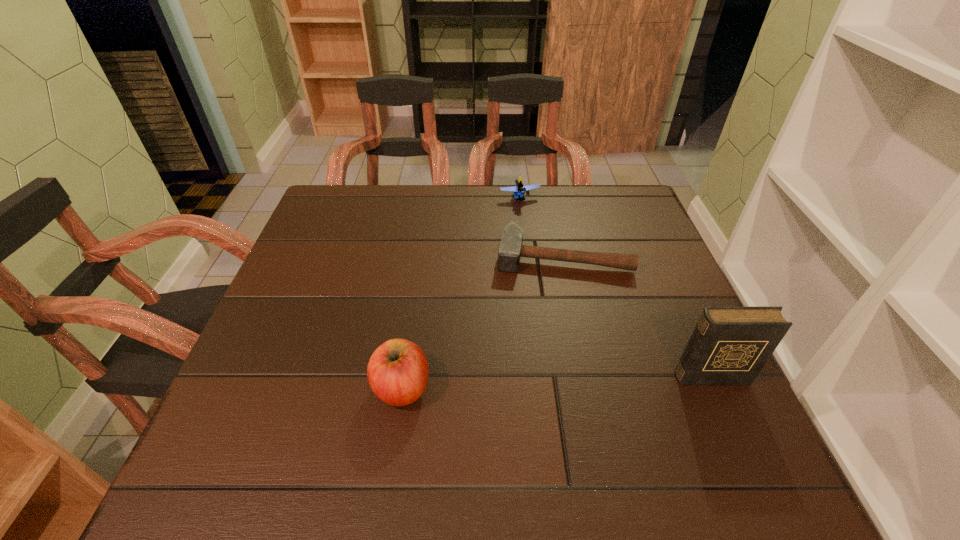
This screenshot has width=960, height=540. What are the coordinates of `vacant spot on the desktop that is between the leftmost object and the diary and is positioned on the front-facing side of the Lego` in the screenshot? It's located at (593, 381).

At what (x,y) coordinates should I click in order to perform the action: click on vacant spot on the desktop that is between the apple and the rightmost object and is positioned on the striking surface of the shortest object. Please return your answer as a coordinate pair (x, y). Looking at the image, I should click on (558, 382).